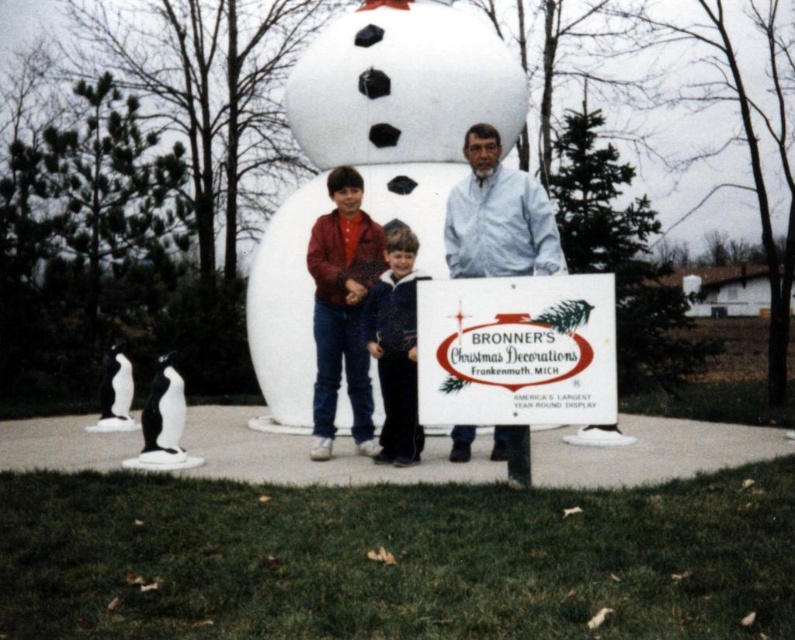
You are a visitor at this festive event and want to read the white paper sign at center. Which direction should you face relative to the white matte jacket at center?

To read the white paper sign at center, you should face to the left of the white matte jacket at center since the white paper sign at center is located to its left.

You are a photographer setting up a camera on a tripod. The camera is 1.5 meters tall. You want to take a photo of the white matte snowman at center and the white matte jacket at center without any obstructions. Since the camera is between them, will the snowman and jacket be visible in the same frame?

The white matte snowman at center and white matte jacket at center are 1.71 meters apart from each other. Since the camera is only 1.5 meters tall, the distance between them is greater than the camera height. Therefore, the snowman and jacket may not be fully visible in the same frame due to the camera height being shorter than their separation distance.

You are a photographer trying to capture a clear photo of the white matte snowman at center and the white matte jacket at center. Since both are white, you need to adjust your camera focus. Which object should you focus on first to ensure it appears sharp in the photo?

The white matte snowman at center is located above the white matte jacket at center, so you should focus on the white matte snowman at center first as it is higher up and more prominent in the scene.